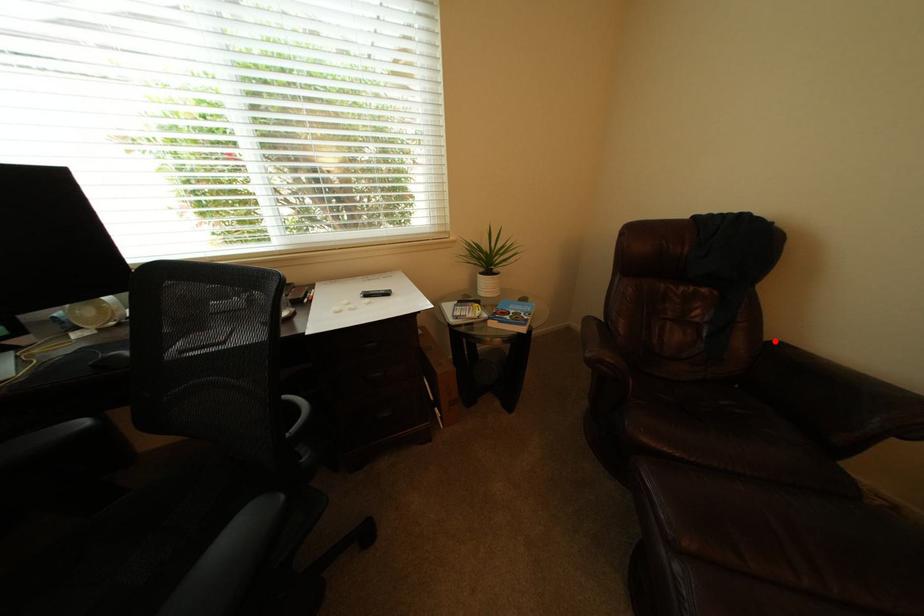
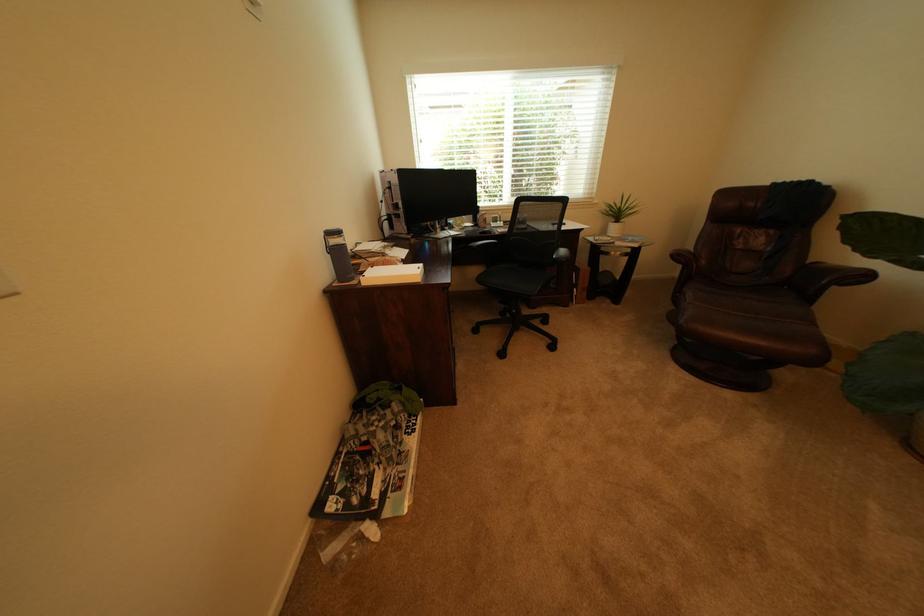
Question: A red point is marked in image1. In image2, is the corresponding 3D point closer to the camera or farther? Reply with the corresponding letter.

Choices:
 (A) The corresponding 3D point is closer.
 (B) The corresponding 3D point is farther.

Answer: (B)